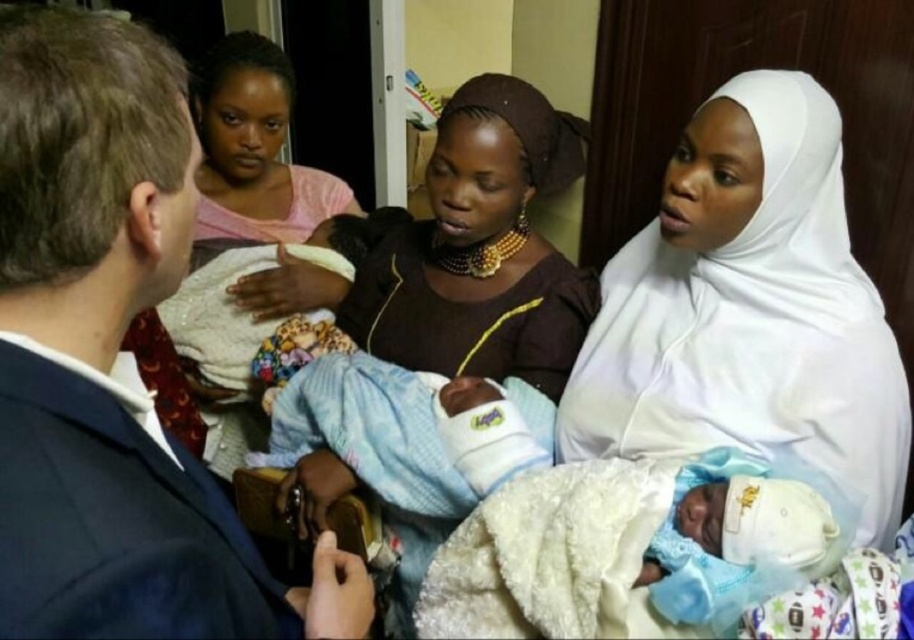
You are organizing a clothing donation drive and need to determine the placement of items based on their positions in the image. If the blue suit jacket at left and the white cloth at center are both to be placed on a shelf, which item should be placed on the lower shelf to match their original positions?

The blue suit jacket at left should be placed on the lower shelf because it is located below the white cloth at center in the image.

You are organizing a clothing donation drive and need to sort items by size. You have a blue suit jacket at left and a white cloth at center. Which item should you place in the small items bin?

The blue suit jacket at left has a smaller size compared to the white cloth at center, so it should be placed in the small items bin.

You are a delivery person who needs to place a small package between the blue suit jacket at left and the white cloth at center. The package is 30 centimeters long. Will there be enough space between them to fit the package?

The blue suit jacket at left and the white cloth at center are 77.18 centimeters apart from each other. Since the package is only 30 centimeters long, there is sufficient space between them to fit the package comfortably.